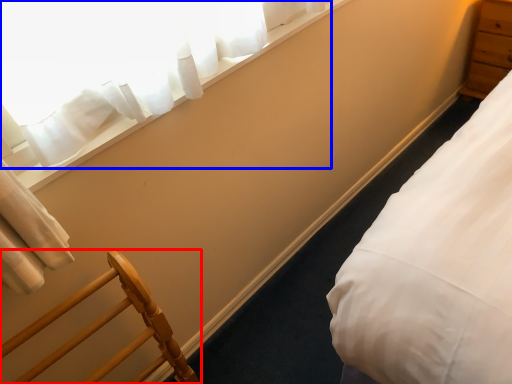
Question: Among these objects, which one is nearest to the camera, furniture (highlighted by a red box) or curtain (highlighted by a blue box)?

Choices:
 (A) furniture
 (B) curtain

Answer: (A)